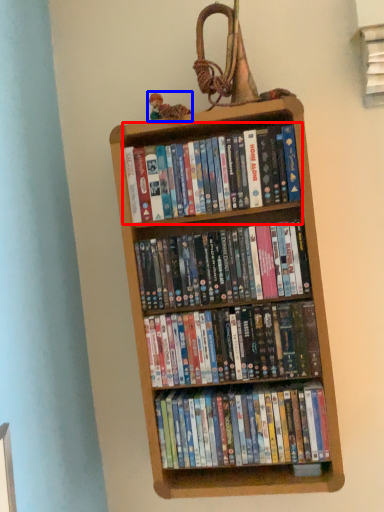
Question: Which of the following is the closest to the observer, book (highlighted by a red box) or toy (highlighted by a blue box)?

Choices:
 (A) book
 (B) toy

Answer: (A)